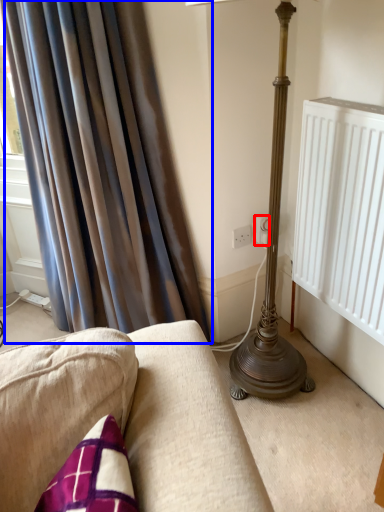
Question: Which of the following is the closest to the observer, electric outlet (highlighted by a red box) or curtain (highlighted by a blue box)?

Choices:
 (A) electric outlet
 (B) curtain

Answer: (B)